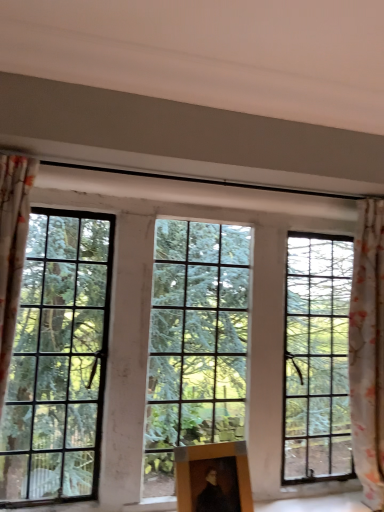
Where is `clear glass window at center`? The image size is (384, 512). clear glass window at center is located at coordinates (151, 294).

Locate an element on the screen. picture frame below the clear glass window at center (from a real-world perspective) is located at coordinates (213, 478).

Between clear glass window at center and wooden picture frame at center, which one appears on the left side from the viewer's perspective?

clear glass window at center is more to the left.

In the scene shown: Is clear glass window at center beside wooden picture frame at center?

No, clear glass window at center is not with wooden picture frame at center.

Is point (262, 291) closer to camera compared to point (366, 430)?

No, it is behind (366, 430).

Which is correct: clear glass window at center is inside floral fabric curtain at right, or outside of it?

clear glass window at center cannot be found inside floral fabric curtain at right.

Who is smaller, clear glass window at center or floral fabric curtain at right?

With smaller size is floral fabric curtain at right.

Does clear glass window at center have a lesser width compared to floral fabric curtain at right?

Indeed, clear glass window at center has a lesser width compared to floral fabric curtain at right.

Is wooden picture frame at center facing towards floral fabric curtain at right?

No, wooden picture frame at center is not oriented towards floral fabric curtain at right.

From the image's perspective, between wooden picture frame at center and floral fabric curtain at right, who is located below?

wooden picture frame at center, from the image's perspective.

Is wooden picture frame at center wider than floral fabric curtain at right?

Incorrect, the width of wooden picture frame at center does not surpass that of floral fabric curtain at right.

Which object is positioned more to the left, wooden picture frame at center or floral fabric curtain at right?

wooden picture frame at center is more to the left.

Based on the photo, which of these two, wooden picture frame at center or clear glass window at center, is bigger?

clear glass window at center is bigger.

Which is nearer, (203, 478) or (140, 472)?

Point (203, 478) appears to be closer to the viewer than point (140, 472).

From the image's perspective, relative to clear glass window at center, is wooden picture frame at center above or below?

wooden picture frame at center is situated lower than clear glass window at center in the image.

Does wooden picture frame at center have a lesser height compared to clear glass window at center?

Correct, wooden picture frame at center is not as tall as clear glass window at center.

Consider the image. From the image's perspective, is floral fabric curtain at right under wooden picture frame at center?

No.

In the image, is floral fabric curtain at right on the left side or the right side of wooden picture frame at center?

floral fabric curtain at right is to the right of wooden picture frame at center.

Considering the positions of point (353, 301) and point (221, 457), is point (353, 301) closer or farther from the camera than point (221, 457)?

Point (353, 301) is farther from the camera than point (221, 457).

Find the location of `picture frame located below the floral fabric curtain at right (from the image's perspective)`. picture frame located below the floral fabric curtain at right (from the image's perspective) is located at coordinates (213, 478).

Which of these two, floral fabric curtain at right or clear glass window at center, stands taller?

floral fabric curtain at right is taller.

Would you say floral fabric curtain at right is a long distance from clear glass window at center?

No.

Is floral fabric curtain at right located outside clear glass window at center?

floral fabric curtain at right lies outside clear glass window at center's area.

Find the location of `window lying behind the wooden picture frame at center`. window lying behind the wooden picture frame at center is located at coordinates (151, 294).

Identify the location of curtain that appears on the right of clear glass window at center. The image size is (384, 512). (368, 351).

Considering their positions, is wooden picture frame at center positioned closer to clear glass window at center than floral fabric curtain at right?

The object closer to clear glass window at center is wooden picture frame at center.

Based on their spatial positions, is clear glass window at center or floral fabric curtain at right closer to wooden picture frame at center?

clear glass window at center is closer to wooden picture frame at center.

Estimate the real-world distances between objects in this image. Which object is further from floral fabric curtain at right, clear glass window at center or wooden picture frame at center?

wooden picture frame at center is positioned further to the anchor floral fabric curtain at right.

Looking at the image, which one is located further to clear glass window at center, floral fabric curtain at right or wooden picture frame at center?

Among the two, floral fabric curtain at right is located further to clear glass window at center.

When comparing their distances from floral fabric curtain at right, does wooden picture frame at center or clear glass window at center seem closer?

clear glass window at center is closer to floral fabric curtain at right.

From the image, which object appears to be nearer to wooden picture frame at center, floral fabric curtain at right or clear glass window at center?

clear glass window at center.

This screenshot has height=512, width=384. Identify the location of picture frame between clear glass window at center and floral fabric curtain at right in the horizontal direction. (213, 478).